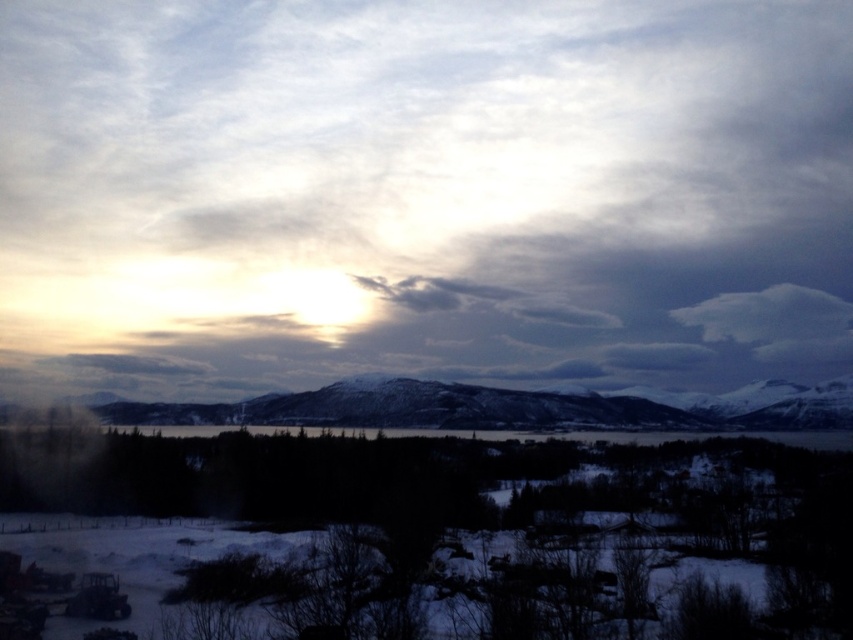
Who is higher up, white fluffy cloud at upper center or snowy rock formation at center?

white fluffy cloud at upper center is higher up.

Is point (637, 256) closer to camera compared to point (106, 419)?

No, (637, 256) is behind (106, 419).

Locate an element on the screen. white fluffy cloud at upper center is located at coordinates (422, 193).